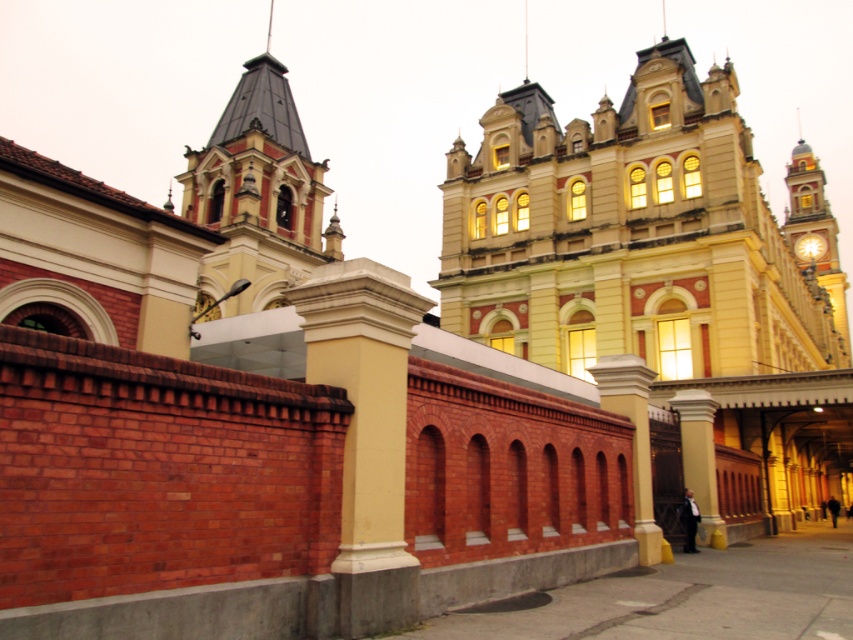
In the scene shown: Does yellow polished stone pillar at center appear on the left side of white marble column at center?

Yes, yellow polished stone pillar at center is to the left of white marble column at center.

Between yellow polished stone pillar at center and white marble column at center, which one is positioned lower?

white marble column at center is below.

Who is more forward, (360,568) or (653,516)?

Positioned in front is point (360,568).

Identify the location of yellow polished stone pillar at center. (366, 432).

Is point (339, 552) more distant than point (817, 221)?

No, (339, 552) is in front of (817, 221).

Which is in front, point (370, 417) or point (788, 241)?

Point (370, 417)

The height and width of the screenshot is (640, 853). Identify the location of yellow polished stone pillar at center. (366, 432).

Who is positioned more to the left, white marble column at center or white stone column at center?

From the viewer's perspective, white marble column at center appears more on the left side.

The image size is (853, 640). What do you see at coordinates (633, 438) in the screenshot? I see `white marble column at center` at bounding box center [633, 438].

Is point (637, 365) closer to viewer compared to point (712, 500)?

That is True.

The width and height of the screenshot is (853, 640). Find the location of `white marble column at center`. white marble column at center is located at coordinates (633, 438).